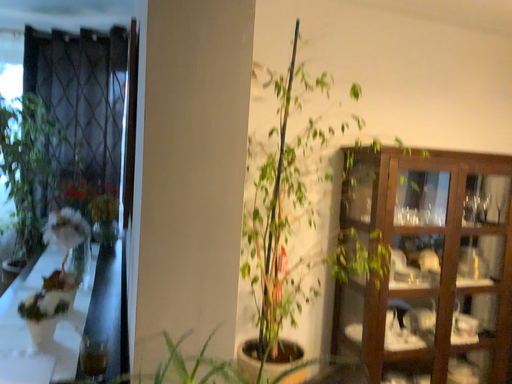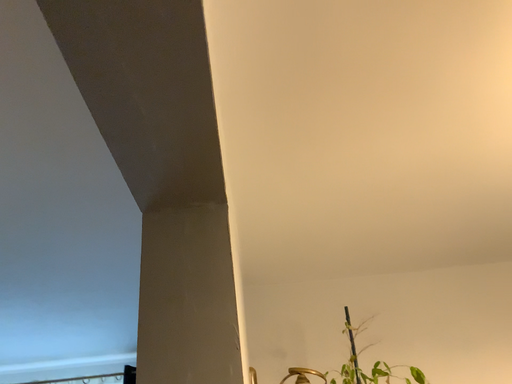
Question: Which way did the camera rotate in the video?

Choices:
 (A) rotated downward
 (B) rotated upward

Answer: (B)